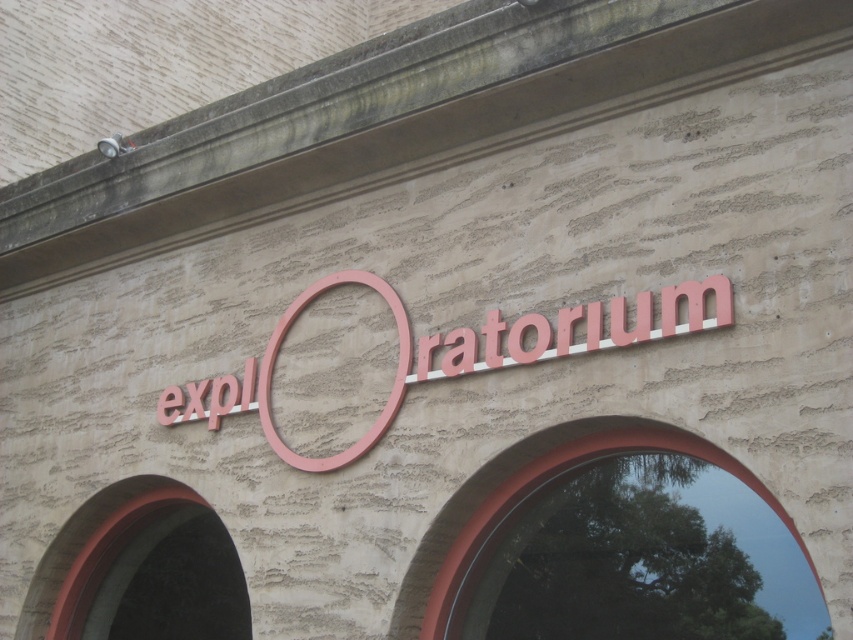
Between pink matte sign at center and smooth glass window at center, which one has more height?

smooth glass window at center

Who is more distant from viewer, (250, 380) or (467, 552)?

Point (250, 380)

Where is `pink matte sign at center`? The width and height of the screenshot is (853, 640). pink matte sign at center is located at coordinates (445, 353).

Is smooth red arch at lower left smaller than smooth glass window at center?

Correct, smooth red arch at lower left occupies less space than smooth glass window at center.

Is smooth red arch at lower left closer to camera compared to smooth glass window at center?

No, smooth red arch at lower left is behind smooth glass window at center.

Describe the element at coordinates (167, 579) in the screenshot. I see `smooth red arch at lower left` at that location.

Find the location of a particular element. smooth red arch at lower left is located at coordinates (167, 579).

Can you confirm if pink matte sign at center is smaller than smooth red arch at lower left?

No, pink matte sign at center is not smaller than smooth red arch at lower left.

Between pink matte sign at center and smooth red arch at lower left, which one appears on the left side from the viewer's perspective?

smooth red arch at lower left

Does point (323, 468) lie behind point (219, 612)?

No, it is not.

Where is `pink matte sign at center`? pink matte sign at center is located at coordinates (445, 353).